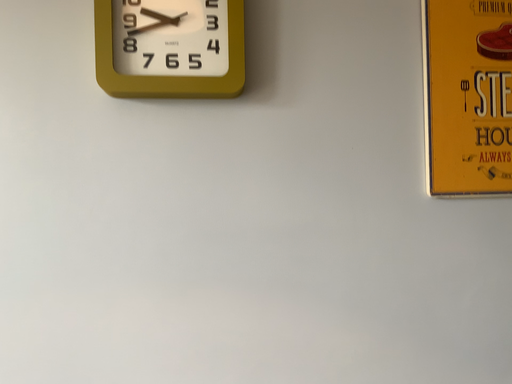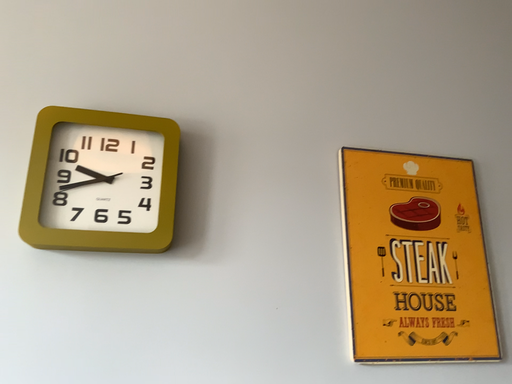
Question: Which way did the camera rotate in the video?

Choices:
 (A) rotated upward
 (B) rotated downward

Answer: (A)